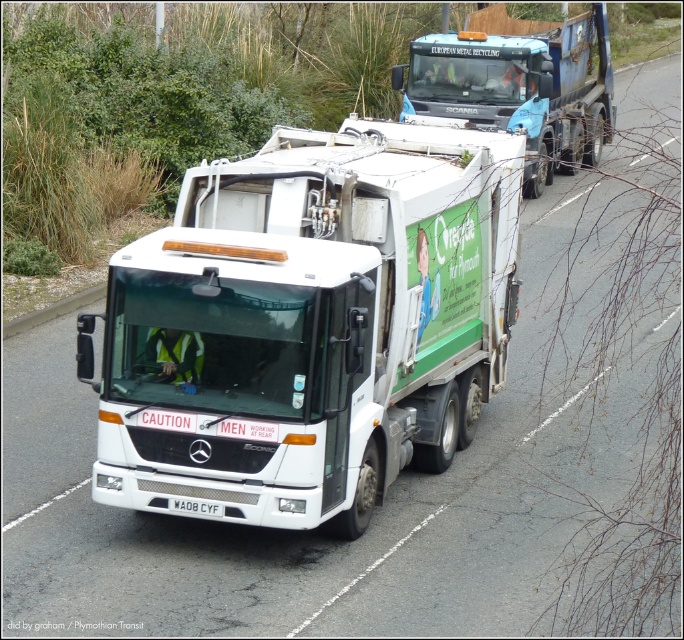
Question: Is blue metallic garbage truck at center above white plastic license plate at center?

Choices:
 (A) yes
 (B) no

Answer: (A)

Question: Is blue metallic garbage truck at center positioned at the back of white plastic license plate at center?

Choices:
 (A) yes
 (B) no

Answer: (A)

Question: Which point is farther from the camera taking this photo?

Choices:
 (A) pyautogui.click(x=185, y=499)
 (B) pyautogui.click(x=415, y=67)

Answer: (B)

Question: Among these objects, which one is nearest to the camera?

Choices:
 (A) blue metallic garbage truck at center
 (B) white matte garbage truck at center
 (C) white plastic license plate at center

Answer: (C)

Question: Does white matte garbage truck at center come behind blue metallic garbage truck at center?

Choices:
 (A) yes
 (B) no

Answer: (B)

Question: Which point is closer to the camera taking this photo?

Choices:
 (A) (562, 44)
 (B) (207, 512)
 (C) (236, 406)

Answer: (C)